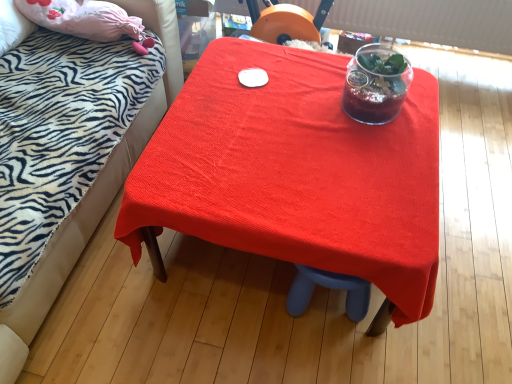
Question: From a real-world perspective, is translucent glass vase at upper center located beneath smooth red tablecloth at center?

Choices:
 (A) no
 (B) yes

Answer: (A)

Question: Considering the relative sizes of translucent glass vase at upper center and smooth red tablecloth at center in the image provided, is translucent glass vase at upper center taller than smooth red tablecloth at center?

Choices:
 (A) yes
 (B) no

Answer: (B)

Question: Is translucent glass vase at upper center thinner than smooth red tablecloth at center?

Choices:
 (A) no
 (B) yes

Answer: (B)

Question: Can we say translucent glass vase at upper center lies outside smooth red tablecloth at center?

Choices:
 (A) no
 (B) yes

Answer: (B)

Question: Is translucent glass vase at upper center to the right of smooth red tablecloth at center from the viewer's perspective?

Choices:
 (A) yes
 (B) no

Answer: (A)

Question: Would you say zebra-patterned fabric bed at upper left is to the left or to the right of smooth red tablecloth at center in the picture?

Choices:
 (A) left
 (B) right

Answer: (A)

Question: In the image, is zebra-patterned fabric bed at upper left positioned in front of or behind smooth red tablecloth at center?

Choices:
 (A) behind
 (B) front

Answer: (B)

Question: Considering the positions of zebra-patterned fabric bed at upper left and smooth red tablecloth at center in the image, is zebra-patterned fabric bed at upper left taller or shorter than smooth red tablecloth at center?

Choices:
 (A) short
 (B) tall

Answer: (B)

Question: In terms of width, does zebra-patterned fabric bed at upper left look wider or thinner when compared to smooth red tablecloth at center?

Choices:
 (A) wide
 (B) thin

Answer: (A)

Question: In terms of width, does translucent glass vase at upper center look wider or thinner when compared to smooth red tablecloth at center?

Choices:
 (A) thin
 (B) wide

Answer: (A)

Question: In the image, is translucent glass vase at upper center positioned in front of or behind smooth red tablecloth at center?

Choices:
 (A) front
 (B) behind

Answer: (B)

Question: Considering the positions of point (391, 77) and point (335, 56), is point (391, 77) closer or farther from the camera than point (335, 56)?

Choices:
 (A) closer
 (B) farther

Answer: (A)

Question: Looking at the image, does translucent glass vase at upper center seem bigger or smaller compared to smooth red tablecloth at center?

Choices:
 (A) big
 (B) small

Answer: (B)

Question: In terms of width, does zebra-patterned fabric bed at upper left look wider or thinner when compared to translucent glass vase at upper center?

Choices:
 (A) thin
 (B) wide

Answer: (B)

Question: Visually, is zebra-patterned fabric bed at upper left positioned to the left or to the right of translucent glass vase at upper center?

Choices:
 (A) left
 (B) right

Answer: (A)